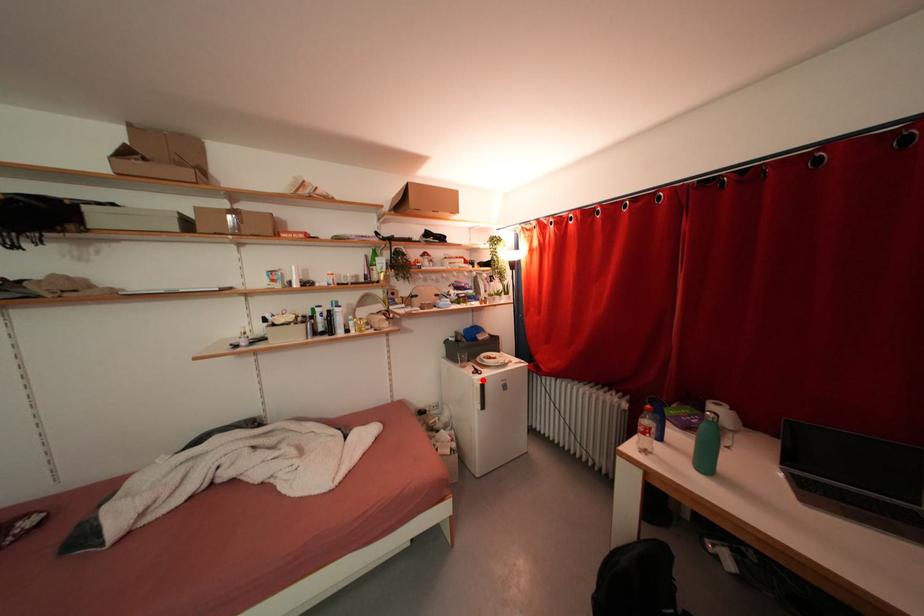
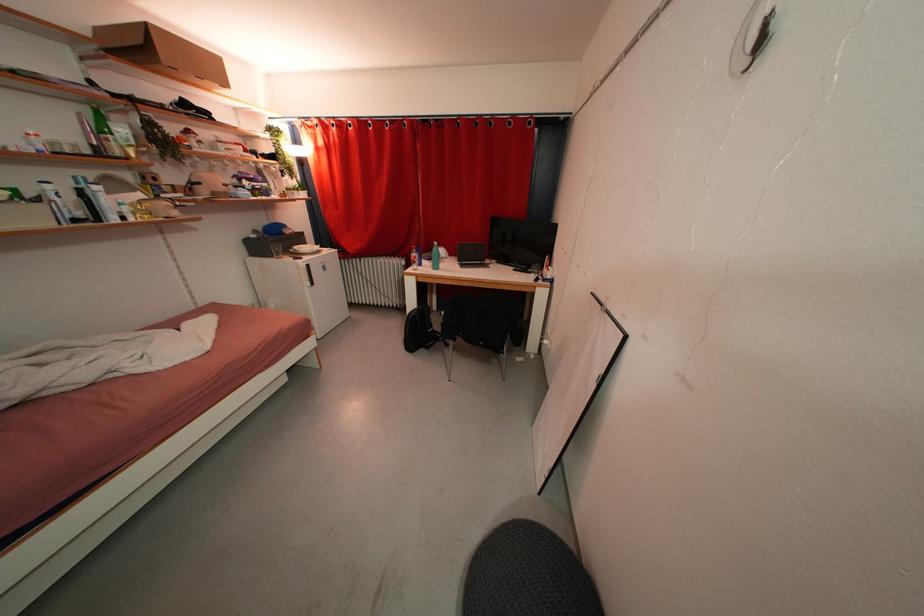
Question: I am providing you with two images of the same scene from different viewpoints. A red point is shown in image1. For the corresponding object point in image2, is it positioned nearer or farther from the camera?

Choices:
 (A) Nearer
 (B) Farther

Answer: (A)